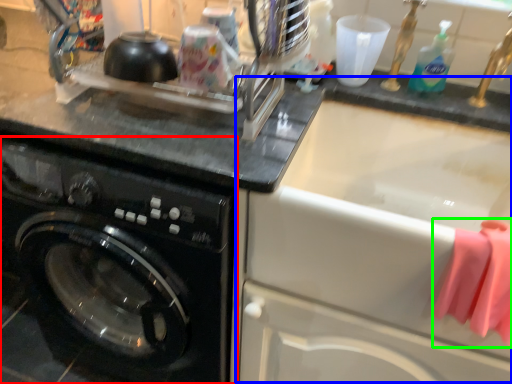
Question: Based on their relative distances, which object is farther from washing machine (highlighted by a red box)? Choose from sink (highlighted by a blue box) and clothe (highlighted by a green box).

Choices:
 (A) sink
 (B) clothe

Answer: (B)